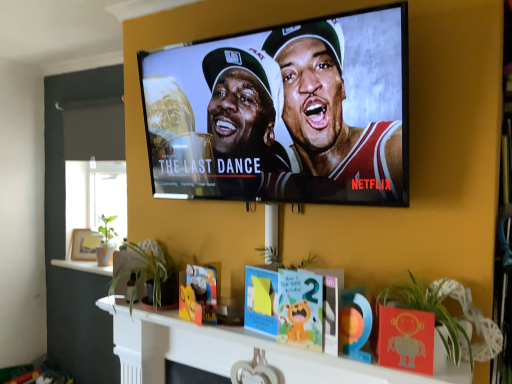
Question: Does point (136, 307) appear closer or farther from the camera than point (206, 102)?

Choices:
 (A) closer
 (B) farther

Answer: (B)

Question: Visually, is wooden heart-shaped ornament at center positioned to the left or to the right of matte black tv at upper center?

Choices:
 (A) left
 (B) right

Answer: (B)

Question: Which of these objects is positioned farthest from the green leafy plant at lower center, which is counted as the 1th plant, starting from the back?

Choices:
 (A) matte black tv at upper center
 (B) wooden heart-shaped ornament at center
 (C) green leafy plant at lower right, placed as the 1th plant when sorted from right to left
 (D) wooden photo frame at left

Answer: (D)

Question: Based on their relative distances, which object is farther from the wooden photo frame at left?

Choices:
 (A) green leafy plant at lower center, which appears as the 2th plant when viewed from the front
 (B) wooden heart-shaped ornament at center
 (C) matte black tv at upper center
 (D) green leafy plant at lower right, placed as the 1th plant when sorted from right to left

Answer: (D)